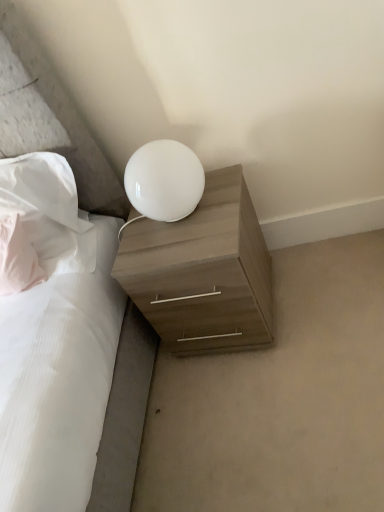
The height and width of the screenshot is (512, 384). I want to click on vacant area that lies in front of light wood/texture nightstand at lower right, so click(x=266, y=398).